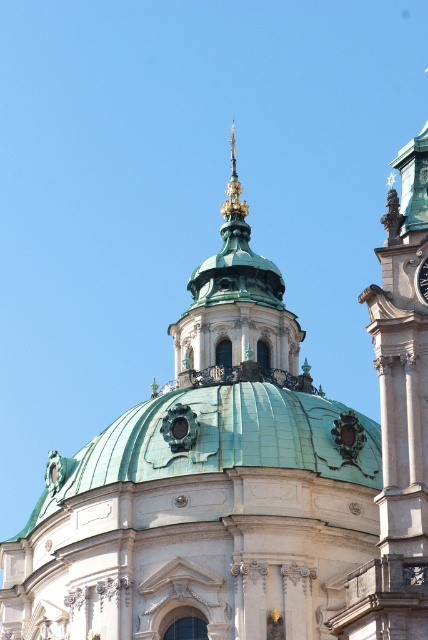
Question: Which point is farther to the camera?

Choices:
 (A) (324, 420)
 (B) (427, 298)

Answer: (A)

Question: Is green copper dome at center positioned before metallic silver clock at upper center?

Choices:
 (A) yes
 (B) no

Answer: (B)

Question: In this image, where is green copper dome at center located relative to metallic silver clock at upper center?

Choices:
 (A) right
 (B) left

Answer: (B)

Question: Which point appears closest to the camera in this image?

Choices:
 (A) (422, 292)
 (B) (232, 413)

Answer: (A)

Question: Is green copper dome at center smaller than metallic silver clock at upper center?

Choices:
 (A) yes
 (B) no

Answer: (B)